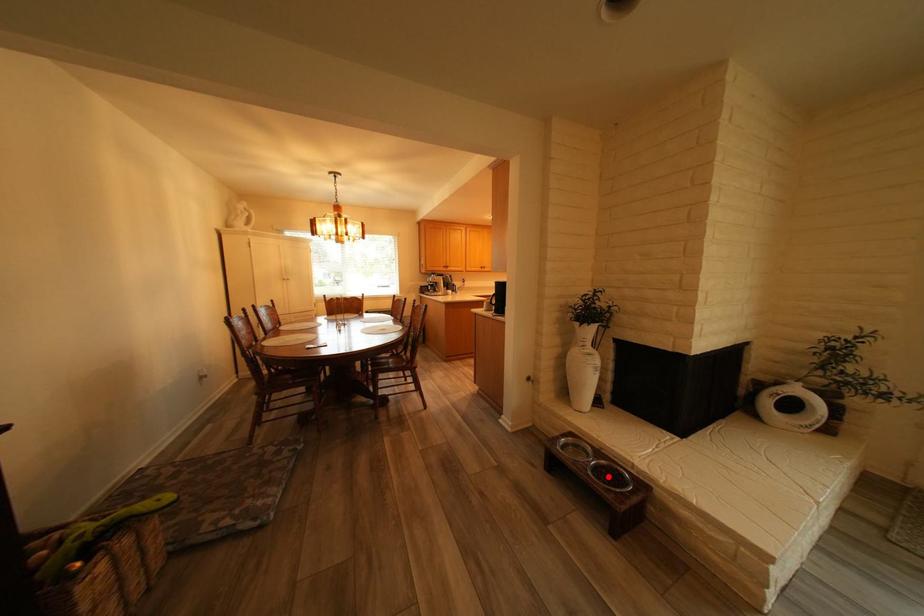
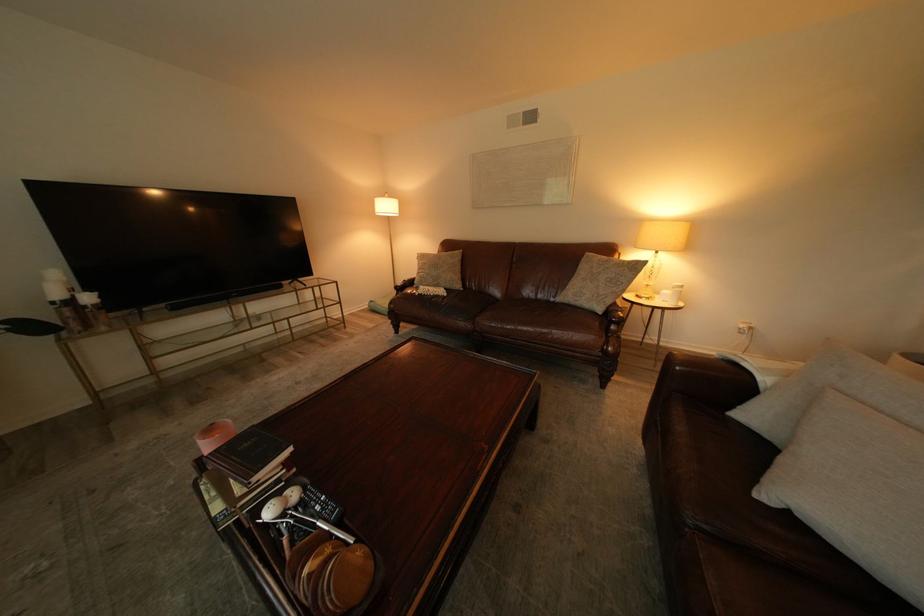
Question: I am providing you with two images of the same scene from different viewpoints. A red point is marked on the first image. Can you still see the location of the red point in image 2?

Choices:
 (A) Yes
 (B) No

Answer: (B)